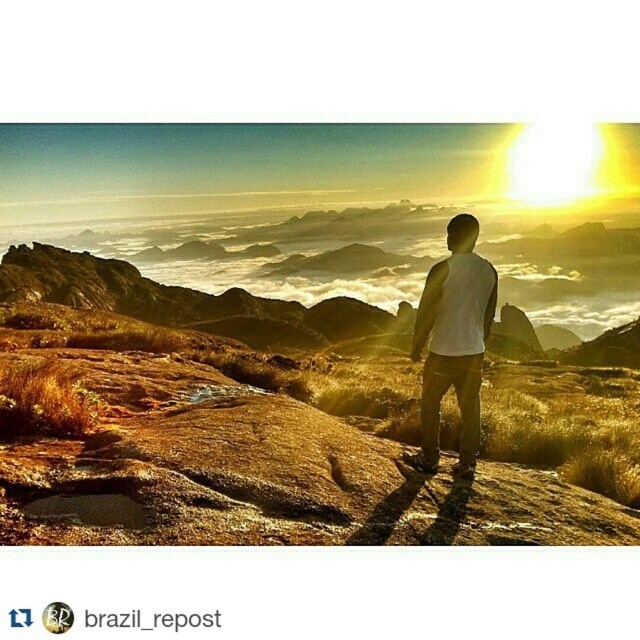
Can you confirm if brown rocky mountain at center is shorter than white matte shirt at center?

Incorrect, brown rocky mountain at center's height does not fall short of white matte shirt at center's.

Is point (1, 422) positioned after point (460, 371)?

No.

This screenshot has height=640, width=640. I want to click on brown rocky mountain at center, so click(280, 422).